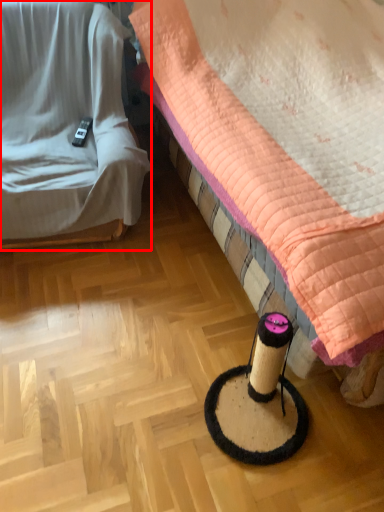
Question: From the image's perspective, where is furniture (annotated by the red box) located relative to bed?

Choices:
 (A) below
 (B) above

Answer: (B)